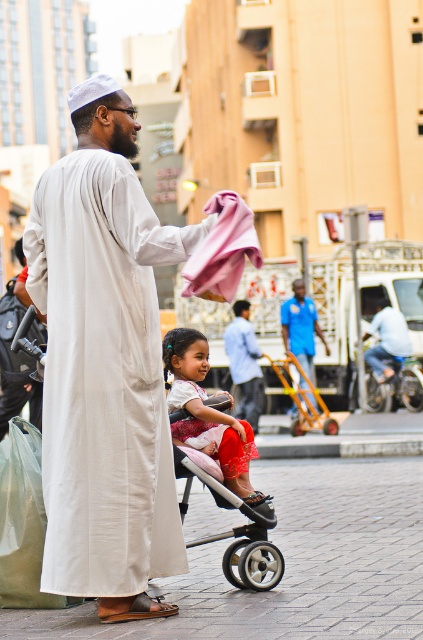
Question: Is matte white robe at center further to the viewer compared to silver metallic stroller at center?

Choices:
 (A) no
 (B) yes

Answer: (A)

Question: Which point is farther from the camera taking this photo?

Choices:
 (A) (203, 362)
 (B) (249, 550)
 (C) (305, 349)
 (D) (44, 401)

Answer: (C)

Question: Which of the following is the farthest from the observer?

Choices:
 (A) light blue shirt at center
 (B) matte beige robe at center
 (C) silver metallic stroller at center

Answer: (A)

Question: Among these objects, which one is farthest from the camera?

Choices:
 (A) blue fabric shirt at center
 (B) light blue shirt at center

Answer: (A)

Question: Does matte pink dress at center have a greater width compared to matte beige robe at center?

Choices:
 (A) no
 (B) yes

Answer: (B)

Question: Does matte beige robe at center have a smaller size compared to light blue shirt at center?

Choices:
 (A) yes
 (B) no

Answer: (B)